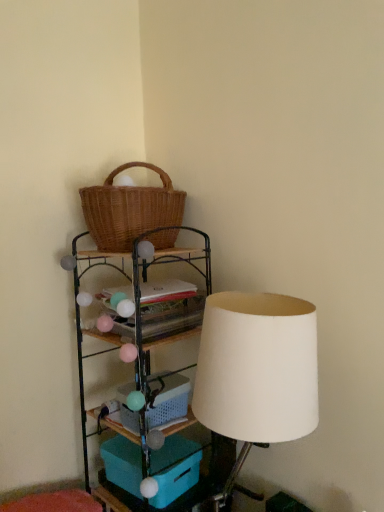
Question: Is woven wood shelf at upper left thinner than plastic/mesh basket at lower center?

Choices:
 (A) yes
 (B) no

Answer: (B)

Question: Is woven wood shelf at upper left facing away from plastic/mesh basket at lower center?

Choices:
 (A) no
 (B) yes

Answer: (B)

Question: Can you confirm if woven wood shelf at upper left is bigger than plastic/mesh basket at lower center?

Choices:
 (A) yes
 (B) no

Answer: (A)

Question: Does woven wood shelf at upper left appear on the left side of plastic/mesh basket at lower center?

Choices:
 (A) yes
 (B) no

Answer: (A)

Question: Does woven wood shelf at upper left have a lesser height compared to plastic/mesh basket at lower center?

Choices:
 (A) no
 (B) yes

Answer: (A)

Question: From the image's perspective, is woven wood shelf at upper left above plastic/mesh basket at lower center?

Choices:
 (A) no
 (B) yes

Answer: (A)

Question: Does white matte lampshade at right contain plastic/mesh basket at lower center?

Choices:
 (A) no
 (B) yes

Answer: (A)

Question: Considering the relative positions of white matte lampshade at right and plastic/mesh basket at lower center in the image provided, is white matte lampshade at right to the right of plastic/mesh basket at lower center from the viewer's perspective?

Choices:
 (A) no
 (B) yes

Answer: (B)

Question: Are white matte lampshade at right and plastic/mesh basket at lower center located far from each other?

Choices:
 (A) no
 (B) yes

Answer: (A)

Question: Is white matte lampshade at right located outside plastic/mesh basket at lower center?

Choices:
 (A) no
 (B) yes

Answer: (B)

Question: From a real-world perspective, is white matte lampshade at right over plastic/mesh basket at lower center?

Choices:
 (A) yes
 (B) no

Answer: (A)

Question: Is white matte lampshade at right directly adjacent to plastic/mesh basket at lower center?

Choices:
 (A) yes
 (B) no

Answer: (B)

Question: Is woven wood shelf at upper left directly adjacent to teal plastic storage box at lower center?

Choices:
 (A) no
 (B) yes

Answer: (A)